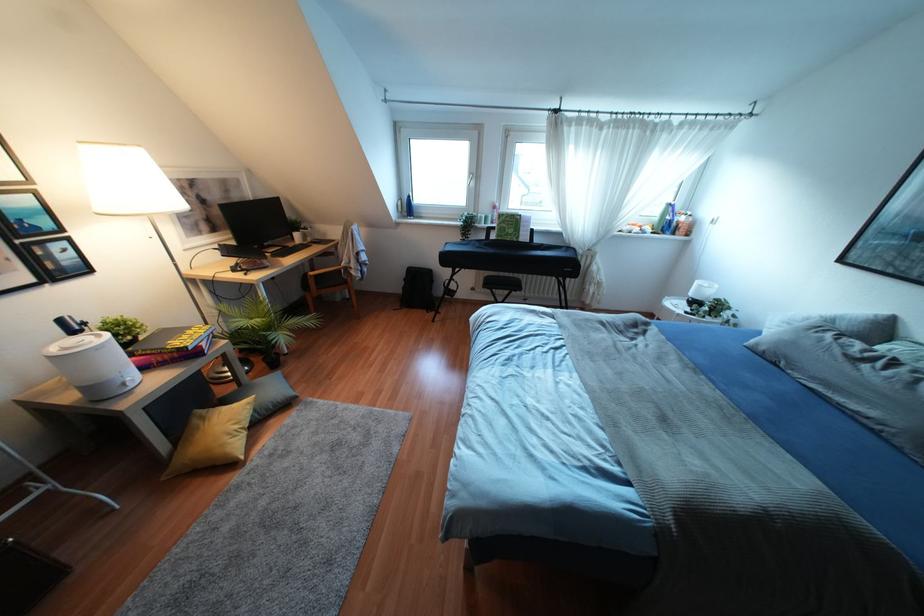
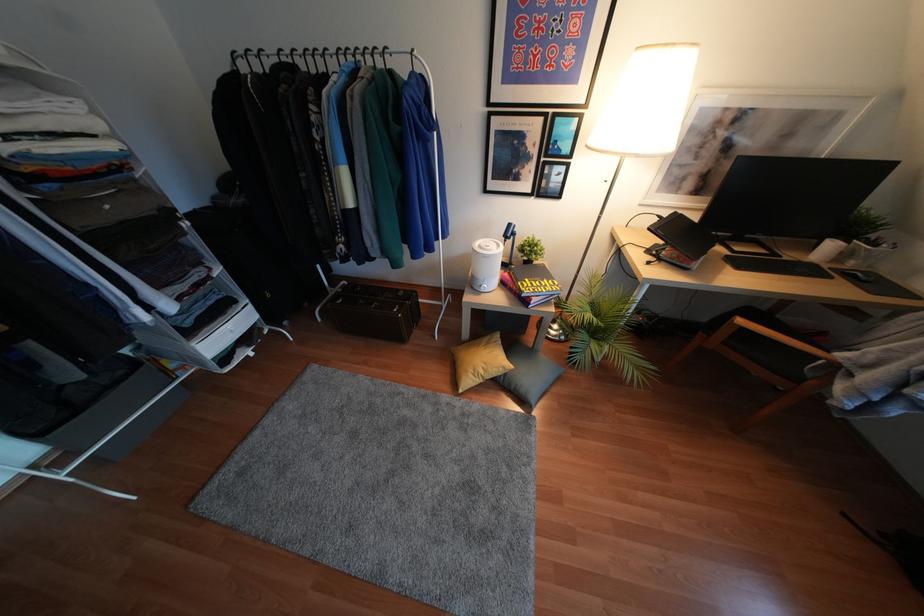
The first image is from the beginning of the video and the second image is from the end. How did the camera likely rotate when shooting the video?

The camera's rotation is toward left-down.